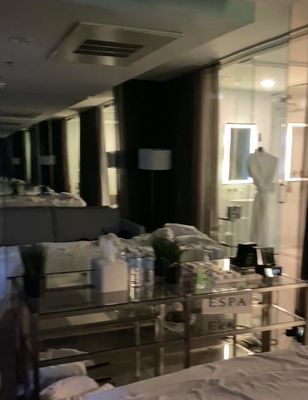
Image resolution: width=308 pixels, height=400 pixels. I want to click on hand sanitizer, so click(x=205, y=275).